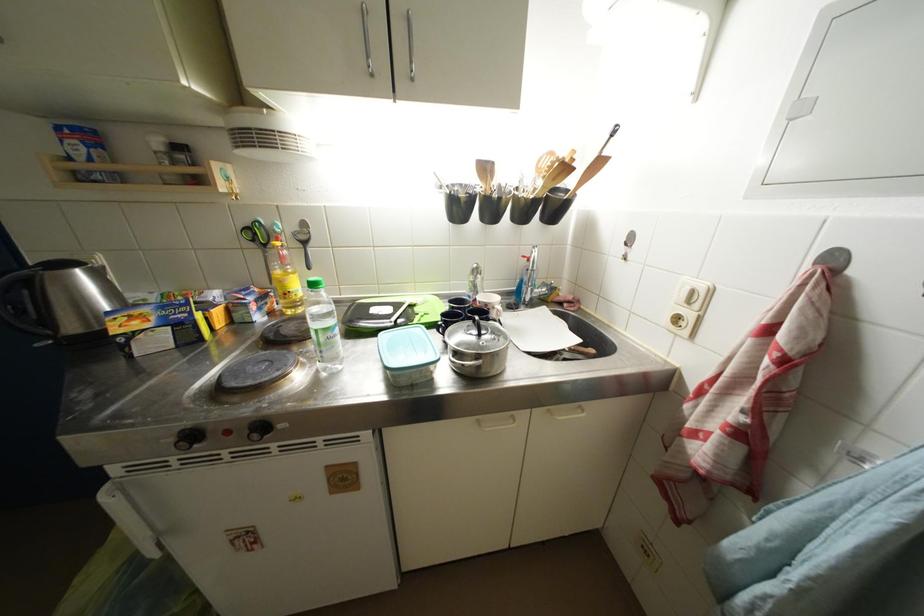
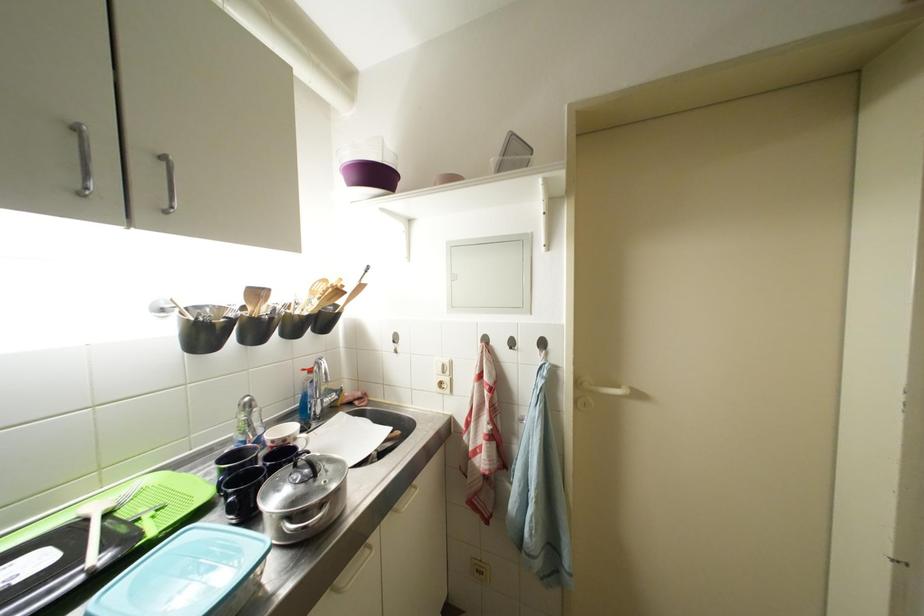
Question: How did the camera likely rotate?

Choices:
 (A) Left
 (B) Right
 (C) Up
 (D) Down

Answer: (B)